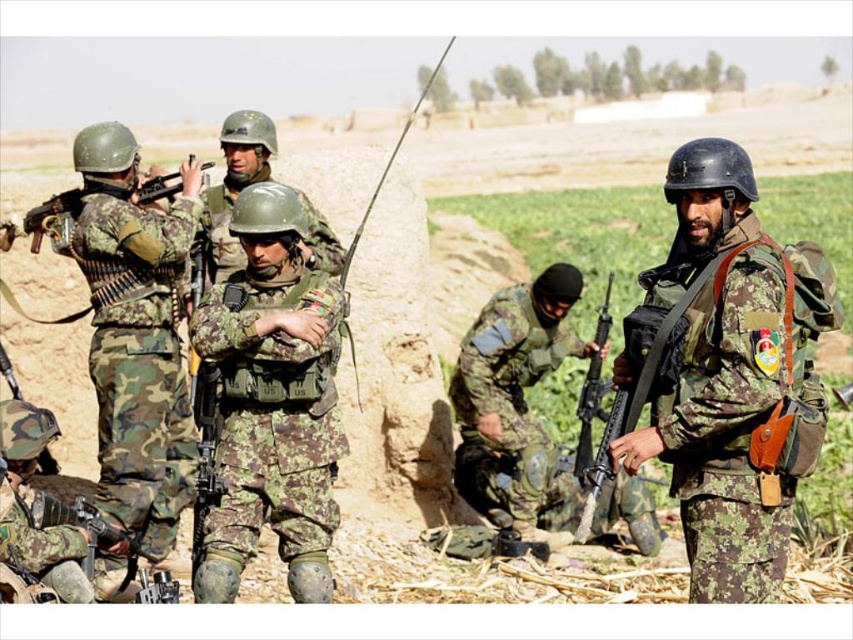
Which is more to the left, camouflage fabric rifle at center or black matte rifle at center?

camouflage fabric rifle at center

Identify the location of camouflage fabric rifle at center. tap(515, 404).

Does camouflage fabric uniform at right appear over black matte rifle at center?

Yes.

Is point (689, 464) farther from viewer compared to point (582, 401)?

No, (689, 464) is closer to viewer.

Does point (689, 346) come closer to viewer compared to point (582, 400)?

That is True.

Find the location of a particular element. The image size is (853, 640). camouflage fabric uniform at right is located at coordinates (737, 394).

Which is behind, point (515, 436) or point (161, 196)?

The point (515, 436) is behind.

Between camouflage fabric rifle at center and matte black rifle at left, which one appears on the left side from the viewer's perspective?

From the viewer's perspective, matte black rifle at left appears more on the left side.

Between point (641, 540) and point (73, 192), which one is positioned in front?

Positioned in front is point (73, 192).

Identify the location of camouflage fabric rifle at center. (515, 404).